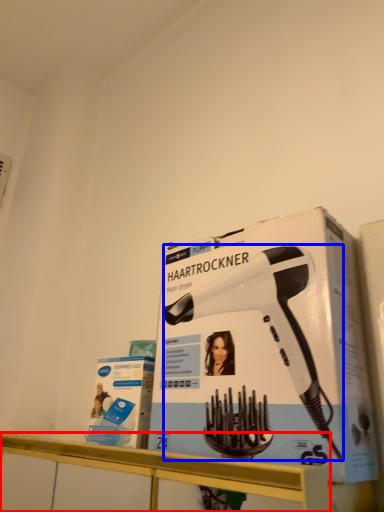
Question: Among these objects, which one is nearest to the camera, counter (highlighted by a red box) or hair drier (highlighted by a blue box)?

Choices:
 (A) counter
 (B) hair drier

Answer: (A)